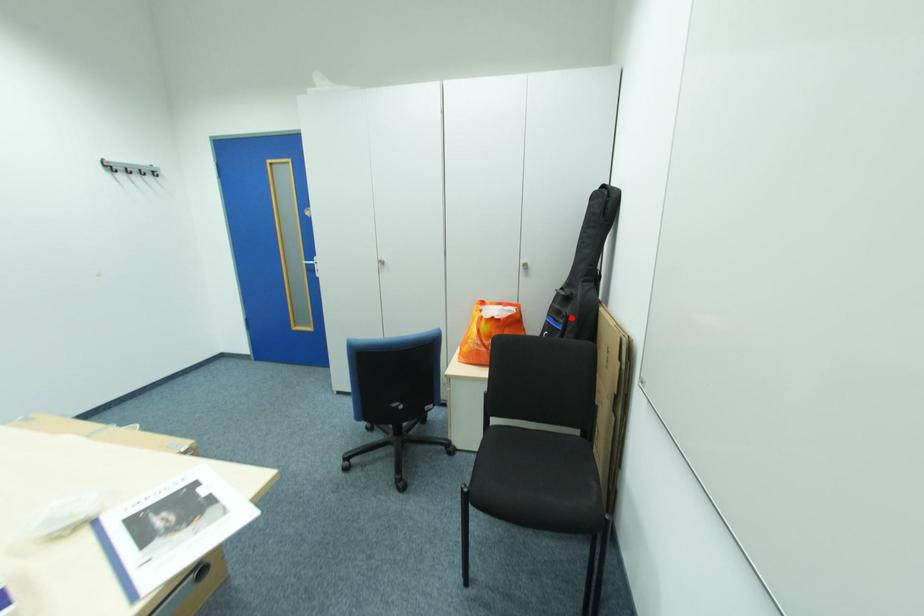
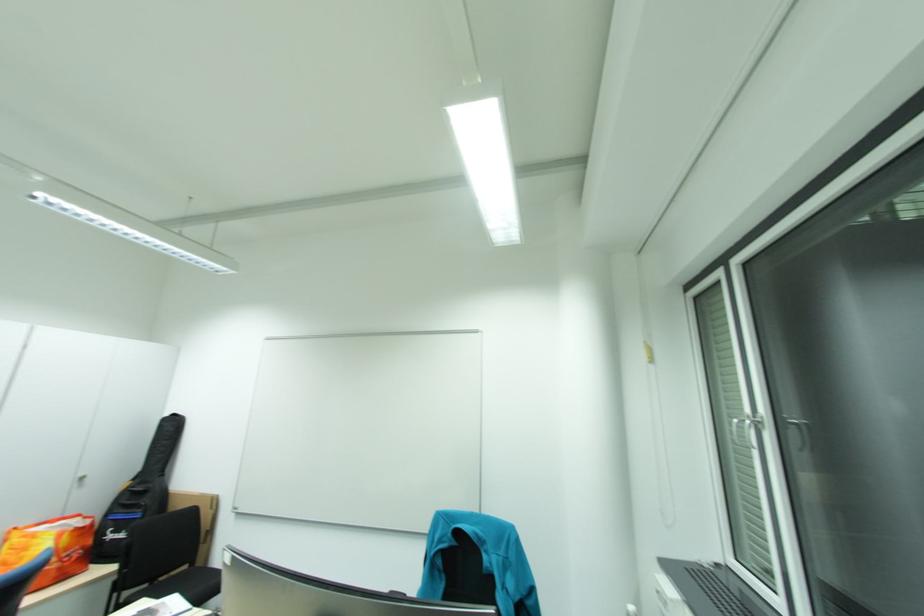
In the second image, find the point that corresponds to the highlighted location in the first image.

(149, 508)